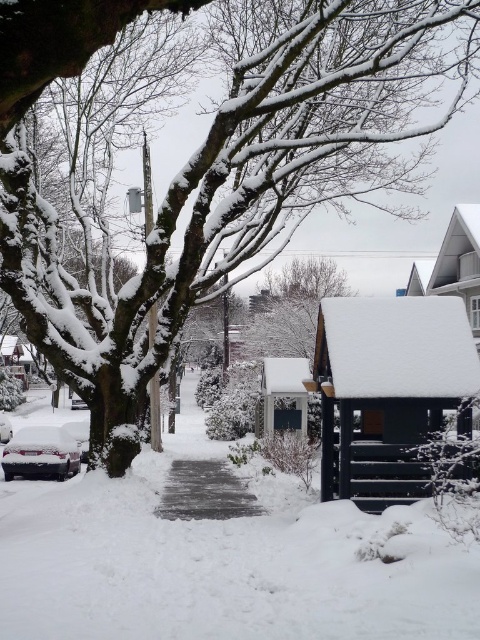
Question: Is gray concrete pavement at center thinner than sleek silver sedan at lower left?

Choices:
 (A) no
 (B) yes

Answer: (A)

Question: Which is farther from the snow-covered sedan at lower left?

Choices:
 (A) sleek silver sedan at lower left
 (B) gray concrete pavement at center

Answer: (B)

Question: Is white fluffy snow at center wider than snow-covered sedan at lower left?

Choices:
 (A) yes
 (B) no

Answer: (A)

Question: Based on their relative distances, which object is farther from the white fluffy snow at center?

Choices:
 (A) snow-covered sedan at lower left
 (B) gray concrete pavement at center

Answer: (A)

Question: Which of these objects is positioned closest to the white fluffy snow at center?

Choices:
 (A) sleek silver sedan at lower left
 (B) gray concrete pavement at center
 (C) snow-covered sedan at lower left

Answer: (B)

Question: Does gray concrete pavement at center have a larger size compared to sleek silver sedan at lower left?

Choices:
 (A) no
 (B) yes

Answer: (B)